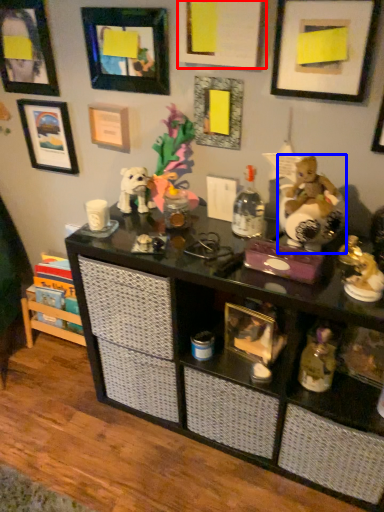
Question: Among these objects, which one is farthest to the camera, picture frame (highlighted by a red box) or toy (highlighted by a blue box)?

Choices:
 (A) picture frame
 (B) toy

Answer: (A)